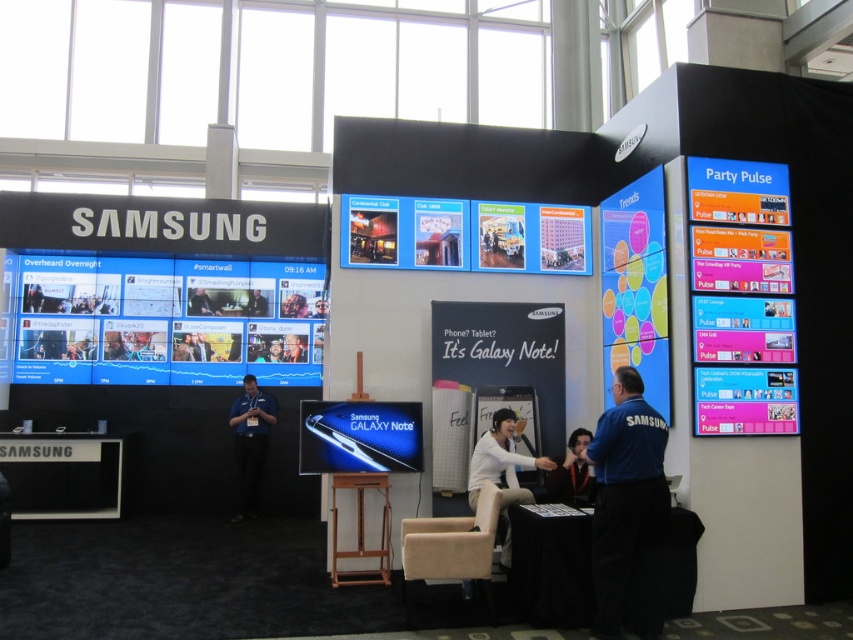
You are a photographer at the Samsung booth and need to capture a clear shot of both the blue fabric shirt at right and the wooden stool at center. Since you want both objects to appear similarly sized in the photo, which object should you move closer to the camera?

Since the blue fabric shirt at right is larger in size than the wooden stool at center, you should move the wooden stool at center closer to the camera to make it appear larger in the photo so both objects appear similarly sized.

You are attending a Samsung trade show and notice a blue fabric shirt at right and a white fabric chair at center. Which object is taller?

The blue fabric shirt at right is taller than the white fabric chair at center.

You are a photographer at the Samsung booth and need to position a camera to capture both the blue fabric shirt at right and the beige fabric chair at lower center in the same frame. The camera has a maximum focus range of 35 inches. Can you capture both objects without moving the camera?

The blue fabric shirt at right is 37.26 inches from the beige fabric chair at lower center. Since the distance exceeds the camera maximum focus range of 35 inches, you cannot capture both objects in the same frame without moving the camera.